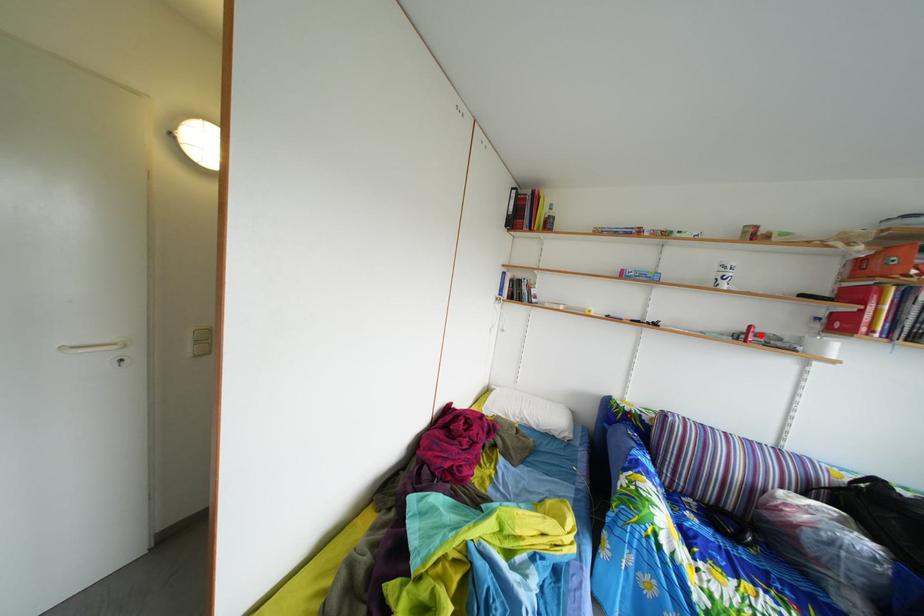
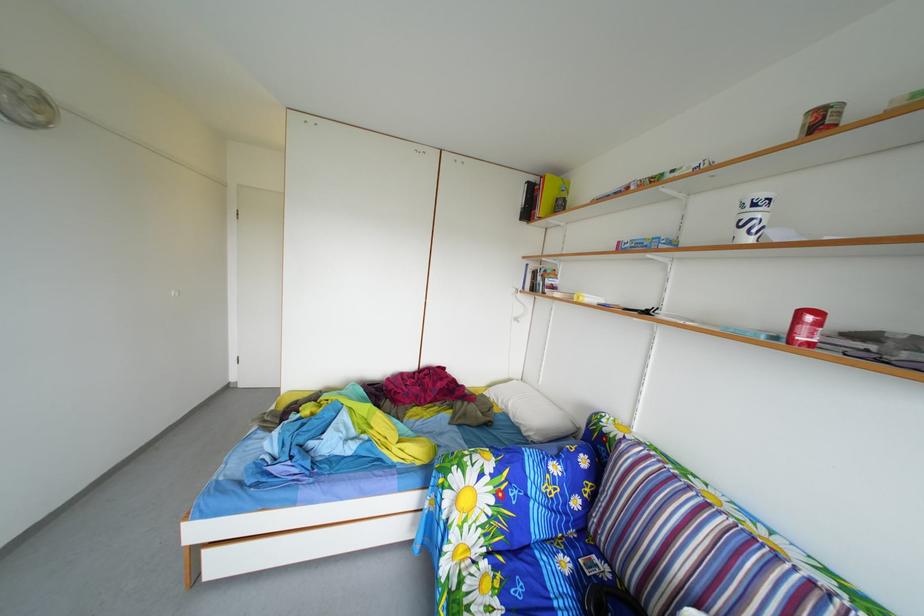
Find the pixel in the second image that matches the highlighted location in the first image.

(811, 321)